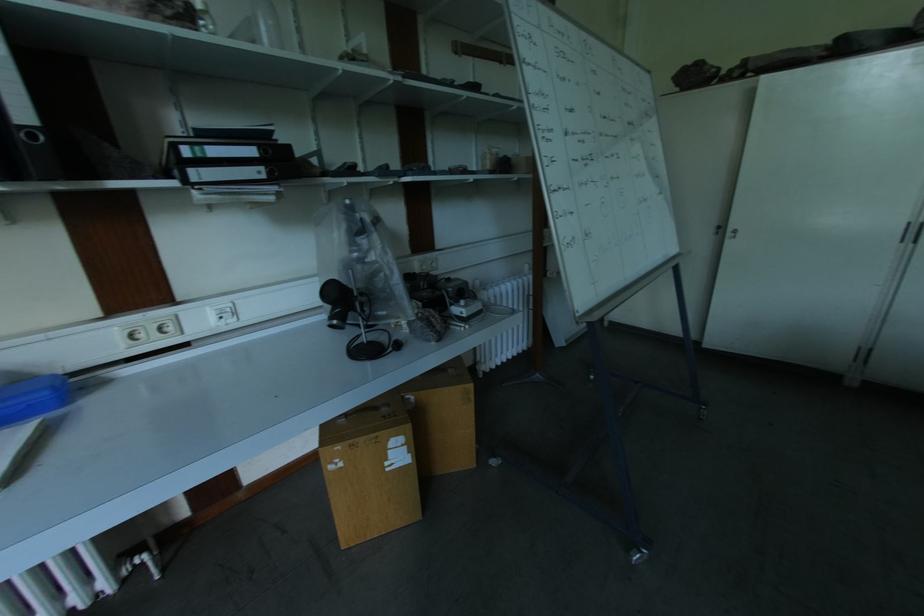
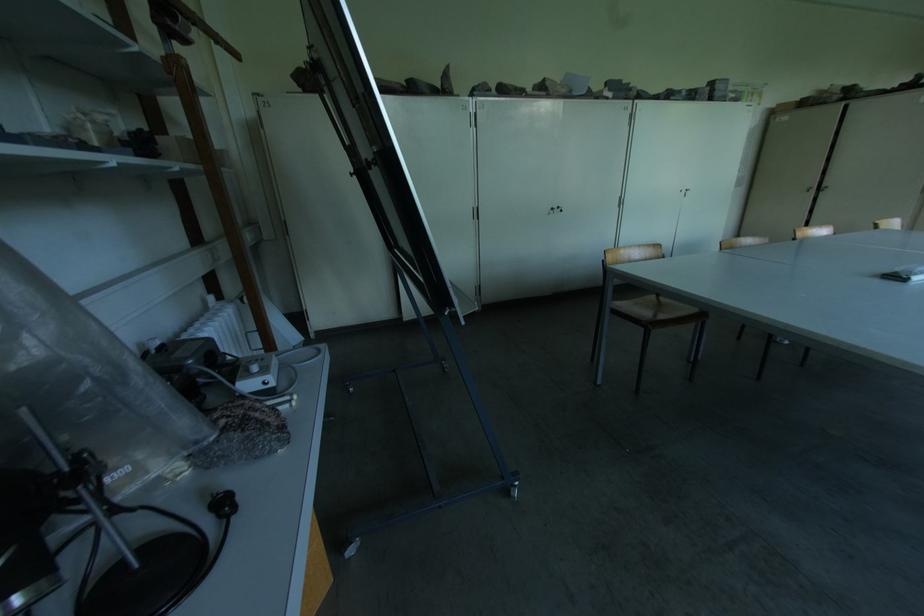
Question: The images are taken continuously from a first-person perspective. In which direction is your viewpoint rotating?

Choices:
 (A) Left
 (B) Right
 (C) Up
 (D) Down

Answer: (B)